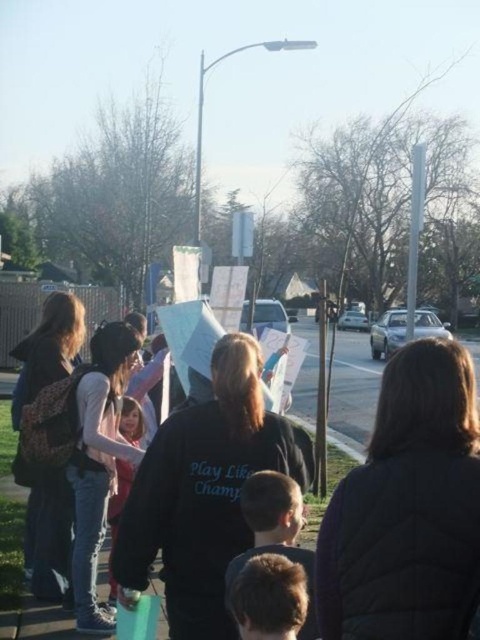
You are a photographer trying to capture a photo of the light pink fabric at center without including the black fabric crowd at center. Based on their sizes, is this possible given their positions?

The black fabric crowd at center is wider than the light pink fabric at center, so it might be challenging to capture the light pink fabric at center without including the black fabric crowd at center in the photo.

You are a photographer trying to capture a photo of the light pink fabric at center and the black fabric crowd at center. From the current camera position, which one is positioned to the right side of the other?

The black fabric crowd at center is to the right of the light pink fabric at center.

You are a photographer trying to capture a photo of the light pink fabric at center without the black fabric crowd at center overlapping it. Based on the scene description, is this possible?

The black fabric crowd at center is larger in size compared to light pink fabric at center, so it is likely blocking the light pink fabric at center, making it difficult to capture without overlap.